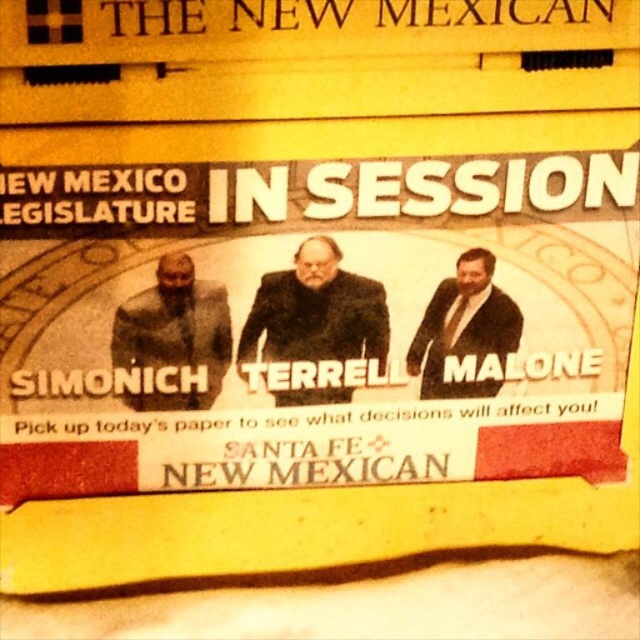
Question: Which object is the closest to the matte black suit at center?

Choices:
 (A) matte black suit at right
 (B) dark brown suit at center

Answer: (B)

Question: Can you confirm if matte black suit at center is positioned below matte black suit at right?

Choices:
 (A) no
 (B) yes

Answer: (B)

Question: Does matte black suit at center come behind matte black suit at right?

Choices:
 (A) no
 (B) yes

Answer: (A)

Question: Which object appears closest to the camera in this image?

Choices:
 (A) matte black suit at right
 (B) matte black suit at center
 (C) dark brown suit at center

Answer: (B)

Question: Is dark brown suit at center below matte black suit at right?

Choices:
 (A) yes
 (B) no

Answer: (B)

Question: Which of the following is the farthest from the observer?

Choices:
 (A) pyautogui.click(x=189, y=289)
 (B) pyautogui.click(x=440, y=348)

Answer: (B)